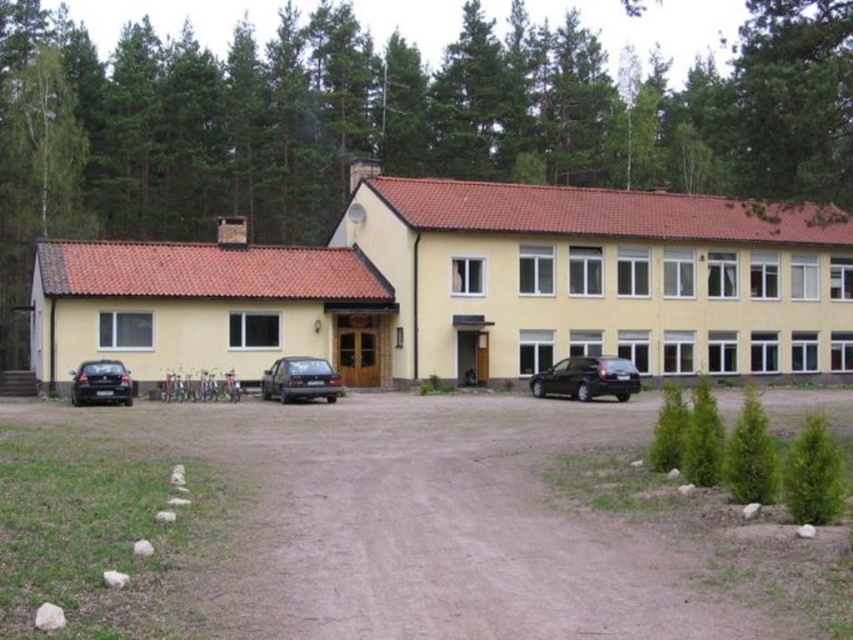
You are a delivery person trying to park your van, which is 2 meters tall, in the parking area in front of the building. You see the black matte car at center and the shiny black car at lower left. Which car should you avoid parking next to if you want to ensure there is enough vertical clearance for your van?

You should avoid parking next to the shiny black car at lower left because the black matte car at center is not as tall as the shiny black car at lower left, meaning the shiny black car at lower left is taller and may not leave enough vertical clearance for your van.

You are a delivery person trying to park your van between the black matte car at center and the satin black hatchback at center. The van is 28 feet long. Can you fit your van between them without moving any other vehicles?

The distance between the black matte car at center and the satin black hatchback at center is 36.02 feet. Since the van is 28 feet long, there is enough space to fit it between them without moving any other vehicles.

You are standing in front of the building and want to park your new car. The satin black hatchback at center and the shiny black car at lower left are already parked. Which car is positioned higher up relative to the other?

The satin black hatchback at center is above the shiny black car at lower left, so it is positioned higher up.